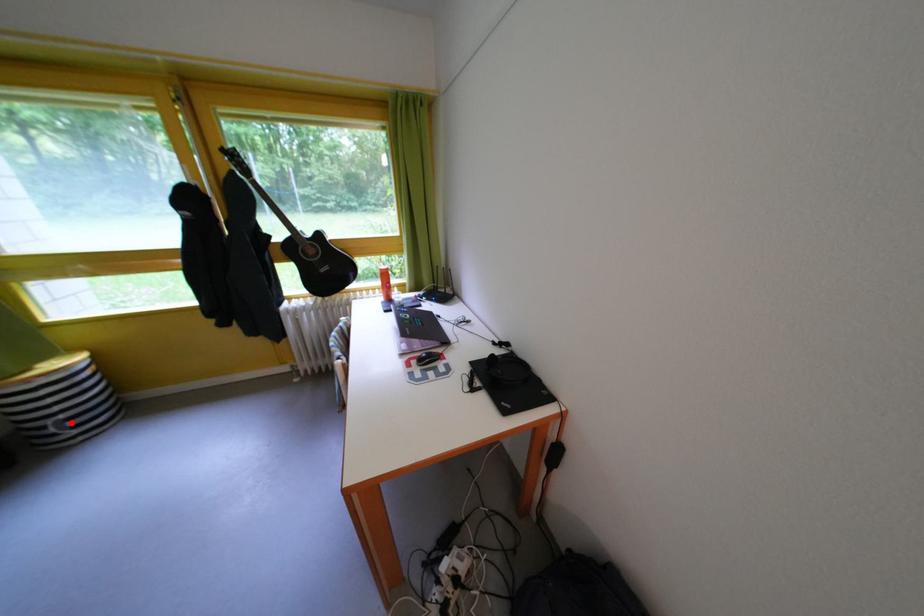
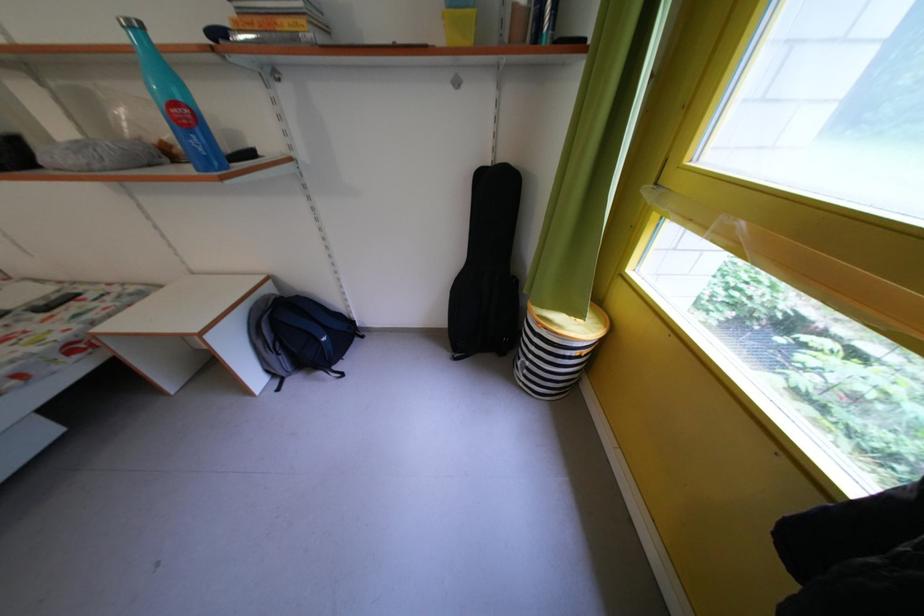
Locate, in the second image, the point that corresponds to the highlighted location in the first image.

(537, 369)